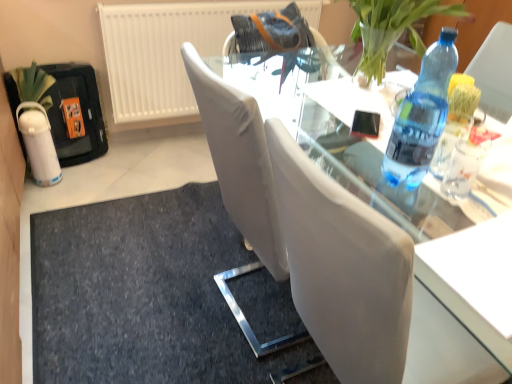
Question: Can white textured radiator at upper left be found inside transparent glass table at center?

Choices:
 (A) yes
 (B) no

Answer: (B)

Question: Is transparent glass table at center to the left of white textured radiator at upper left from the viewer's perspective?

Choices:
 (A) no
 (B) yes

Answer: (A)

Question: From a real-world perspective, is transparent glass table at center under white textured radiator at upper left?

Choices:
 (A) no
 (B) yes

Answer: (A)

Question: Can you confirm if transparent glass table at center is taller than white textured radiator at upper left?

Choices:
 (A) yes
 (B) no

Answer: (A)

Question: Is transparent glass table at center wider than white textured radiator at upper left?

Choices:
 (A) no
 (B) yes

Answer: (B)

Question: Is dark gray fabric doormat at lower center spatially inside blue plastic bottle at right, or outside of it?

Choices:
 (A) inside
 (B) outside

Answer: (B)

Question: From the image's perspective, is dark gray fabric doormat at lower center positioned above or below blue plastic bottle at right?

Choices:
 (A) above
 (B) below

Answer: (B)

Question: Is dark gray fabric doormat at lower center taller or shorter than blue plastic bottle at right?

Choices:
 (A) short
 (B) tall

Answer: (A)

Question: Considering the positions of dark gray fabric doormat at lower center and blue plastic bottle at right in the image, is dark gray fabric doormat at lower center bigger or smaller than blue plastic bottle at right?

Choices:
 (A) big
 (B) small

Answer: (A)

Question: Is transparent glass table at center wider or thinner than white textured radiator at upper left?

Choices:
 (A) wide
 (B) thin

Answer: (A)

Question: From the image's perspective, is transparent glass table at center above or below white textured radiator at upper left?

Choices:
 (A) below
 (B) above

Answer: (A)

Question: In the image, is transparent glass table at center positioned in front of or behind white textured radiator at upper left?

Choices:
 (A) behind
 (B) front

Answer: (B)

Question: From a real-world perspective, is transparent glass table at center physically located above or below white textured radiator at upper left?

Choices:
 (A) above
 (B) below

Answer: (A)

Question: Is dark gray fabric doormat at lower center inside or outside of transparent glass table at center?

Choices:
 (A) inside
 (B) outside

Answer: (B)

Question: From a real-world perspective, is dark gray fabric doormat at lower center above or below transparent glass table at center?

Choices:
 (A) above
 (B) below

Answer: (B)